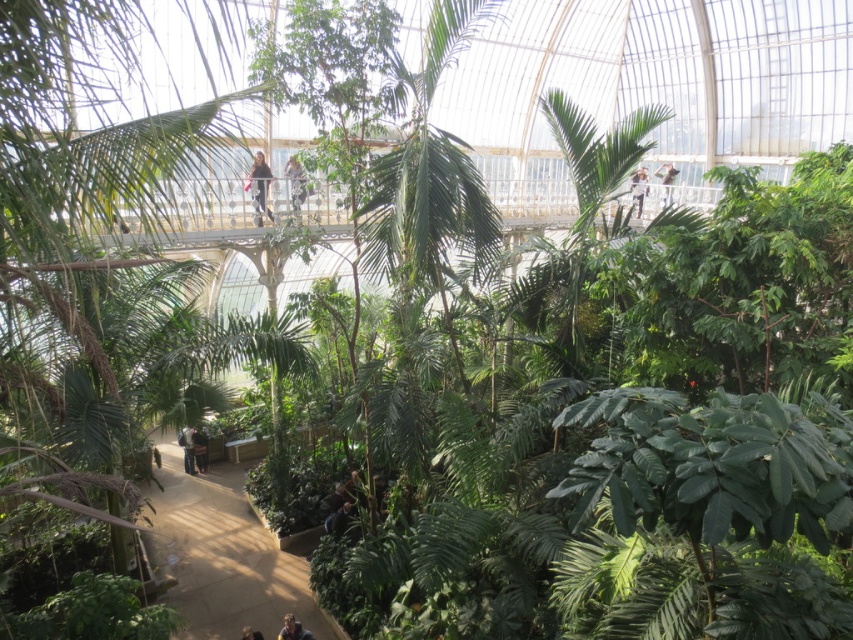
Question: Observing the image, what is the correct spatial positioning of dark blue jeans at lower center in reference to light brown leather shoe at lower center?

Choices:
 (A) left
 (B) right

Answer: (A)

Question: Which point is farther to the camera?

Choices:
 (A) dark hair person at upper center
 (B) dark blue jeans at lower center

Answer: (B)

Question: Which object appears closest to the camera in this image?

Choices:
 (A) light brown leather shoe at lower center
 (B) white fabric at upper center
 (C) light brown leather jacket at upper center

Answer: (A)

Question: Is light brown leather jacket at upper center wider than light brown leather shoe at lower center?

Choices:
 (A) yes
 (B) no

Answer: (A)

Question: Does white fabric at upper center come behind light brown leather shoe at lower center?

Choices:
 (A) yes
 (B) no

Answer: (A)

Question: Which of these objects is positioned closest to the light brown leather jacket at upper center?

Choices:
 (A) light brown hair at lower center
 (B) dark hair person at upper center
 (C) white fabric at upper center
 (D) dark blue jeans at lower center

Answer: (B)